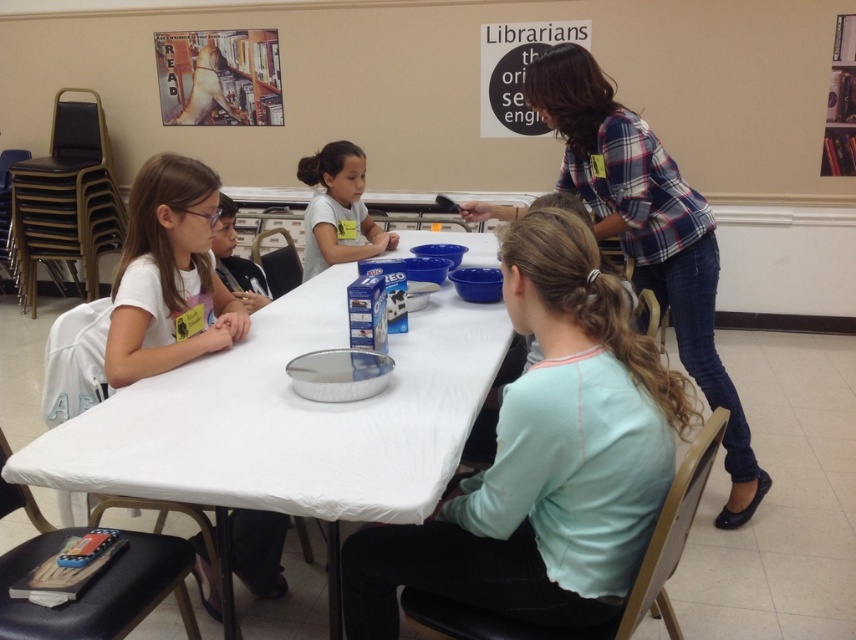
You are a photographer trying to capture a candid shot of the children at the table. You notice the light blue fabric shirt at center and the white matte shirt at left. Which child is sitting to the right of the other?

The light blue fabric shirt at center is positioned on the right side of white matte shirt at left, so the child wearing the light blue fabric shirt at center is sitting to the right of the child in the white matte shirt at left.

You are standing at the entrance of the room and see the white matte shirt at left. If you want to walk directly to it, which direction should you head towards?

The white matte shirt at left is located at point (169,269), so you should head towards the left side of the room to reach it.

You are standing in the room and want to reach the point at coordinates [158,177]. The table is 5 feet away from you. Is the point closer to you than the table?

The distance of point [158,177] from viewer is 6.46 feet, which is farther than the table at 5 feet away. Therefore, the point is not closer to you than the table.